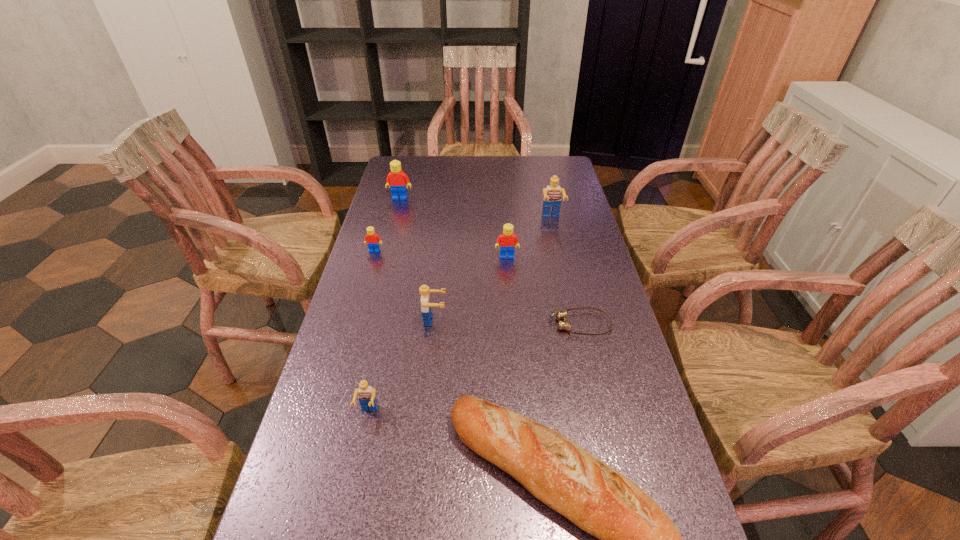
Locate an element on the screen. This screenshot has width=960, height=540. the farthest object is located at coordinates (396, 180).

Find the location of a particular element. The height and width of the screenshot is (540, 960). the farthest Lego is located at coordinates (396, 180).

You are a GUI agent. You are given a task and a screenshot of the screen. Output one action in this format:
    pyautogui.click(x=<x>, y=<y>)
    Task: Click on the rightmost blue Lego
    The width and height of the screenshot is (960, 540).
    Given the screenshot: What is the action you would take?
    pyautogui.click(x=552, y=198)

Locate an element on the screen. The height and width of the screenshot is (540, 960). the second farthest object is located at coordinates (552, 198).

Where is `the second nearest Lego`? The image size is (960, 540). the second nearest Lego is located at coordinates (427, 315).

This screenshot has height=540, width=960. Identify the location of the fourth Lego from left to right. (427, 315).

Locate an element on the screen. the fifth nearest object is located at coordinates (507, 240).

Where is `the fourth farthest Lego`? the fourth farthest Lego is located at coordinates (507, 240).

Where is `the second nearest red Lego`? the second nearest red Lego is located at coordinates (372, 239).

Find the location of a particular element. The height and width of the screenshot is (540, 960). the smallest red Lego is located at coordinates tap(372, 239).